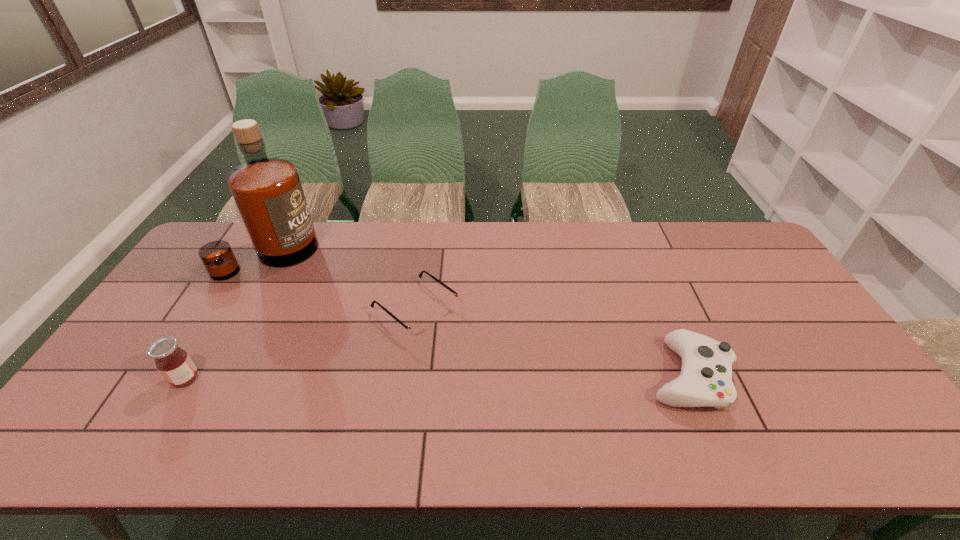
Find the location of a particular element. Image resolution: width=960 pixels, height=540 pixels. jam is located at coordinates (175, 365).

At what (x,y) coordinates should I click in order to perform the action: click on control. Please return your answer as a coordinate pair (x, y). This screenshot has height=540, width=960. Looking at the image, I should click on (705, 380).

Image resolution: width=960 pixels, height=540 pixels. I want to click on the third tallest object, so (705, 380).

Locate an element on the screen. This screenshot has height=540, width=960. the tallest object is located at coordinates (267, 192).

The height and width of the screenshot is (540, 960). Find the location of `spectacles`. spectacles is located at coordinates (420, 326).

Identify the location of the shortest object. This screenshot has width=960, height=540. [x=420, y=326].

The width and height of the screenshot is (960, 540). What are the coordinates of `vacant space located on the label side of the third shortest object` in the screenshot? It's located at (140, 379).

This screenshot has height=540, width=960. Find the location of `vacant area situated on the label side of the third shortest object`. vacant area situated on the label side of the third shortest object is located at coordinates (140, 379).

At what (x,y) coordinates should I click in order to perform the action: click on free space located on the label side of the third shortest object. Please return your answer as a coordinate pair (x, y). Looking at the image, I should click on (117, 379).

Locate an element on the screen. vacant space located 0.240m on the right of the rightmost object is located at coordinates 825,376.